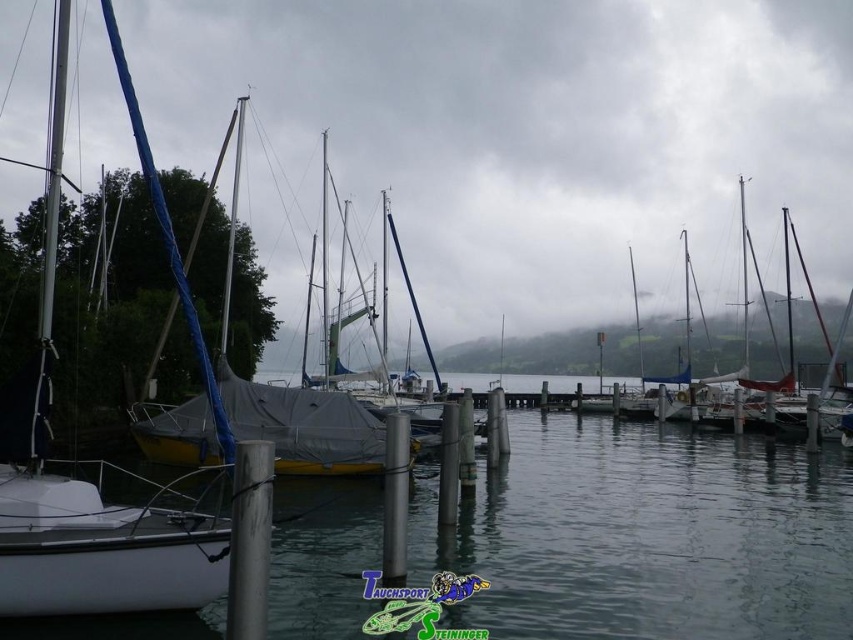
You are standing on the dock and looking at the clear water at center and the white tarpaulin sailboat at center. Which object is closer to the water surface?

The clear water at center is below the white tarpaulin sailboat at center, so the clear water at center is closer to the water surface.